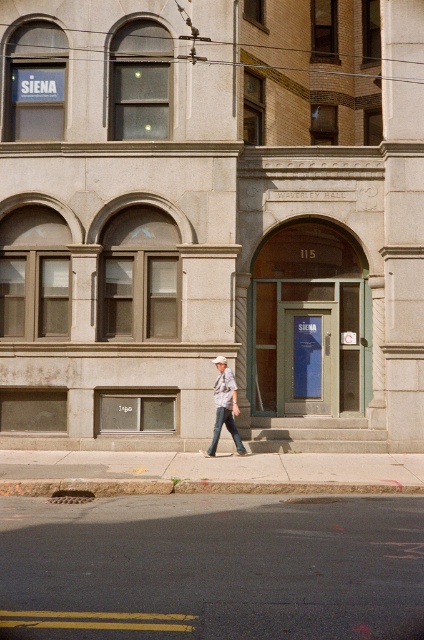
Question: Is black asphalt at lower center below denim jeans at center?

Choices:
 (A) no
 (B) yes

Answer: (B)

Question: Does black asphalt at lower center appear over denim jeans at center?

Choices:
 (A) yes
 (B) no

Answer: (B)

Question: Does black asphalt at lower center come behind denim jeans at center?

Choices:
 (A) no
 (B) yes

Answer: (A)

Question: Among these points, which one is farthest from the camera?

Choices:
 (A) (215, 433)
 (B) (119, 500)

Answer: (A)